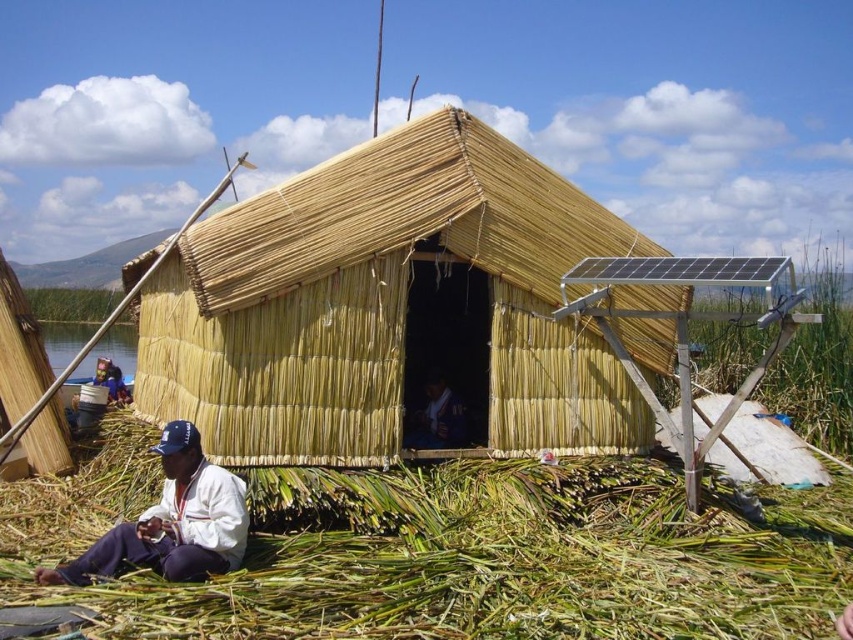
Question: Estimate the real-world distances between objects in this image. Which object is closer to the white fabric at lower left?

Choices:
 (A) straw-thatched hut at center
 (B) dark blue fabric at center

Answer: (A)

Question: Among these objects, which one is farthest from the camera?

Choices:
 (A) white fabric at lower left
 (B) dark blue fabric at center
 (C) straw-thatched hut at center

Answer: (B)

Question: Is the position of straw-thatched hut at center less distant than that of white fabric at lower left?

Choices:
 (A) yes
 (B) no

Answer: (B)

Question: Is green grassy hay at lower center smaller than white fabric at lower left?

Choices:
 (A) no
 (B) yes

Answer: (B)

Question: Which of these objects is positioned farthest from the straw-thatched hut at center?

Choices:
 (A) dark blue fabric at center
 (B) green grassy hay at lower center
 (C) white fabric at lower left

Answer: (B)

Question: Is straw-thatched hut at center behind white fabric at lower left?

Choices:
 (A) yes
 (B) no

Answer: (A)